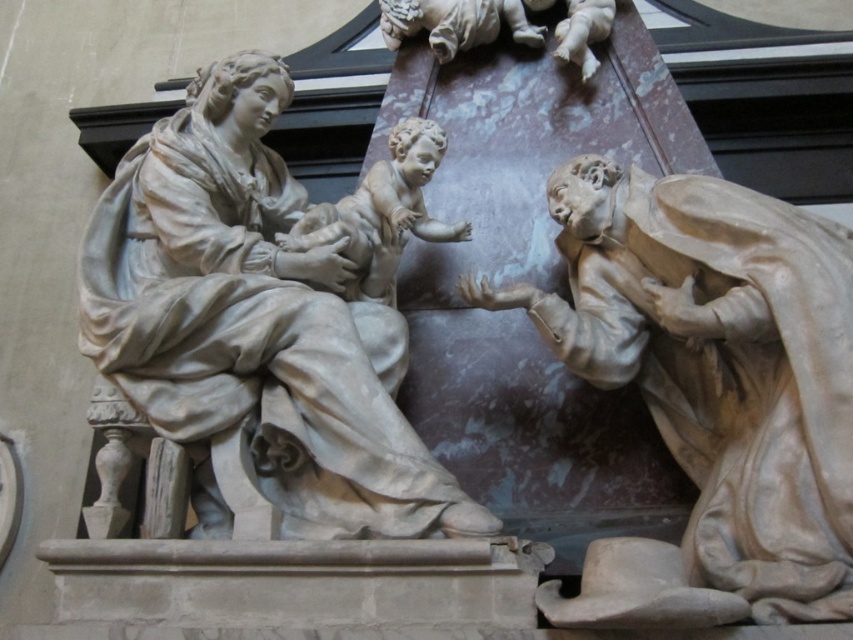
What is located at the coordinates point (381, 212)?

The location at point (381, 212) contains a matte stone baby at center.

You are an art conservator examining the white marble statue at upper left and the matte stone baby at center. Which object is located higher up in the image?

The white marble statue at upper left is positioned under the matte stone baby at center, so the matte stone baby at center is higher up in the image.

You are an art conservator examining the marble sculpture. You need to determine the spatial relationship between the matte beige statue at right and the matte stone baby at center. Which object is positioned lower in the sculpture?

The matte beige statue at right is located below matte stone baby at center, so the matte beige statue at right is positioned lower in the sculpture.